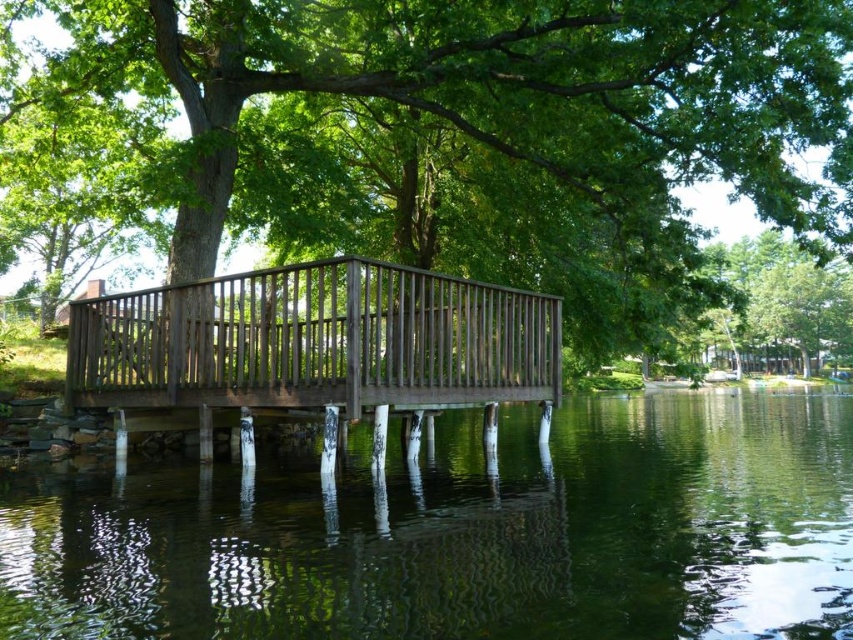
You are standing on the wooden bridge in the scene. You want to place a small potted plant exactly at point (315, 340). What object will the potted plant be placed on?

The potted plant will be placed on the dark brown wood rail at center located at point (315, 340).

You are an architect designing a new bridge and want to ensure the railings are proportionate to nearby trees. Given the scene, which object is thinner, the dark brown wood rail at center or the green leafy tree at upper right?

The dark brown wood rail at center is thinner than the green leafy tree at upper right according to the scene description.

You are a photographer planning to capture the green reflective water at center and the green leafy tree at upper right in a single shot. Considering their sizes in the image, which one would appear smaller in the photo?

The green reflective water at center would appear smaller in the photo because it has a smaller size compared to the green leafy tree at upper right.